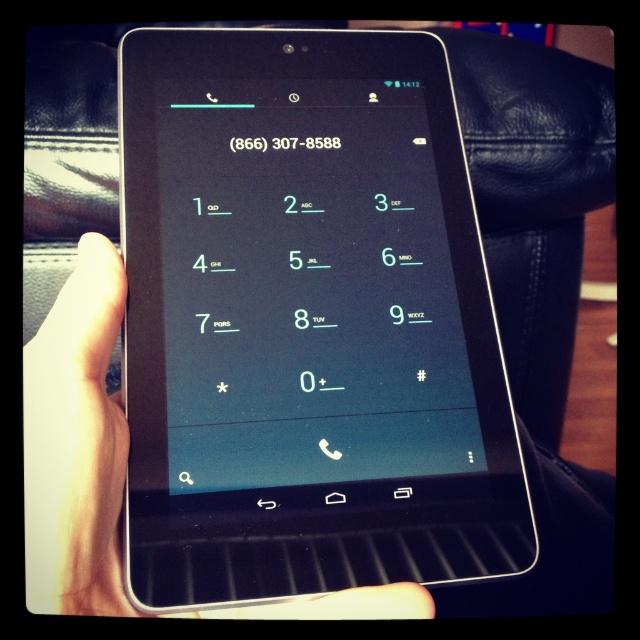
Based on the photo, you are trying to dial the phone number displayed on the tablet. The black glossy tablet at center is in your view, and you also see the white matte hand at center. Which object is closer to the right edge of your field of view?

The black glossy tablet at center is positioned on the right side of white matte hand at center, so it is closer to the right edge of your field of view.

You are trying to reach the white matte hand at center to retrieve the black glossy tablet at center. Since the tablet is closer to you, can you easily grab it without moving your hand?

The black glossy tablet at center is closer to you than the white matte hand at center, so you can easily grab it without needing to move your hand.

You are trying to dial the phone number displayed on the black glossy tablet at center using the keypad shown. However, your hand, the white matte hand at center, is blocking part of the screen. Can you still see the entire phone number clearly?

The black glossy tablet at center is positioned over the white matte hand at center, so the hand is underneath the tablet. Since the tablet is above the hand, the entire phone number should still be visible and not obstructed by the hand.